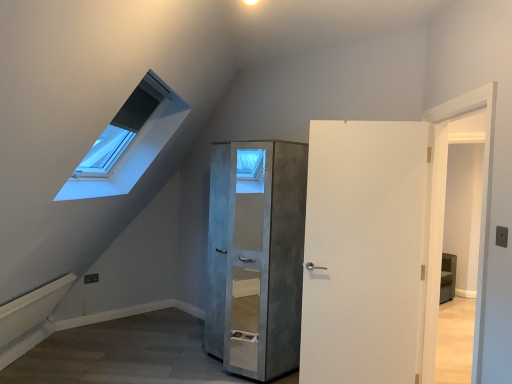
Where is `concrete textured cabinet at center`? This screenshot has width=512, height=384. concrete textured cabinet at center is located at coordinates click(256, 256).

What is the approximate width of concrete textured cabinet at center?

25.72 inches.

Describe the element at coordinates (256, 256) in the screenshot. Image resolution: width=512 pixels, height=384 pixels. I see `concrete textured cabinet at center` at that location.

I want to click on white matte door at center, so click(x=366, y=251).

In order to face white matte door at center, should I rotate leftwards or rightwards?

A 14.179 degree turn to the right will do.

Describe the element at coordinates (366, 251) in the screenshot. I see `white matte door at center` at that location.

Where is `concrete textured cabinet at center`? Image resolution: width=512 pixels, height=384 pixels. concrete textured cabinet at center is located at coordinates (256, 256).

Which is more to the right, concrete textured cabinet at center or white matte door at center?

Positioned to the right is white matte door at center.

Is concrete textured cabinet at center further to the viewer compared to white matte door at center?

Yes.

Does point (296, 180) appear closer or farther from the camera than point (413, 197)?

Clearly, point (296, 180) is more distant from the camera than point (413, 197).

From the image's perspective, is concrete textured cabinet at center located above white matte door at center?

No, from the image's perspective, concrete textured cabinet at center is not over white matte door at center.

From a real-world perspective, is concrete textured cabinet at center positioned above or below white matte door at center?

Clearly, from a real-world perspective, concrete textured cabinet at center is below white matte door at center.

Considering the sizes of objects concrete textured cabinet at center and white matte door at center in the image provided, who is wider, concrete textured cabinet at center or white matte door at center?

Wider between the two is concrete textured cabinet at center.

In terms of height, does concrete textured cabinet at center look taller or shorter compared to white matte door at center?

Considering their sizes, concrete textured cabinet at center has more height than white matte door at center.

Considering the relative sizes of concrete textured cabinet at center and white matte door at center in the image provided, is concrete textured cabinet at center smaller than white matte door at center?

No.

Is white matte door at center completely or partially inside concrete textured cabinet at center?

No, white matte door at center is not inside concrete textured cabinet at center.

Is concrete textured cabinet at center with white matte door at center?

No, concrete textured cabinet at center is not making contact with white matte door at center.

Is concrete textured cabinet at center facing towards white matte door at center?

No, concrete textured cabinet at center does not turn towards white matte door at center.

Where is `cupboard below the white matte door at center (from the image's perspective)`? The height and width of the screenshot is (384, 512). cupboard below the white matte door at center (from the image's perspective) is located at coordinates (256, 256).

Which object is positioned more to the left, white matte door at center or concrete textured cabinet at center?

concrete textured cabinet at center.

Based on the photo, considering their positions, is white matte door at center located in front of or behind concrete textured cabinet at center?

white matte door at center is positioned closer to the viewer than concrete textured cabinet at center.

Considering the points (327, 231) and (277, 228), which point is behind, point (327, 231) or point (277, 228)?

The point (277, 228) is more distant.

From the image's perspective, is white matte door at center positioned above or below concrete textured cabinet at center?

Based on their image positions, white matte door at center is located above concrete textured cabinet at center.

From a real-world perspective, which is physically below, white matte door at center or concrete textured cabinet at center?

concrete textured cabinet at center.

Which of these two, white matte door at center or concrete textured cabinet at center, is wider?

concrete textured cabinet at center.

Considering the relative sizes of white matte door at center and concrete textured cabinet at center in the image provided, is white matte door at center shorter than concrete textured cabinet at center?

Correct, white matte door at center is not as tall as concrete textured cabinet at center.

Is white matte door at center bigger than concrete textured cabinet at center?

Incorrect, white matte door at center is not larger than concrete textured cabinet at center.

Can concrete textured cabinet at center be found inside white matte door at center?

No, concrete textured cabinet at center is not inside white matte door at center.

Are white matte door at center and concrete textured cabinet at center located far from each other?

No, white matte door at center is not far away from concrete textured cabinet at center.

Is white matte door at center facing away from concrete textured cabinet at center?

No, white matte door at center is not facing the opposite direction of concrete textured cabinet at center.

How much distance is there between white matte door at center and concrete textured cabinet at center?

They are 27.16 inches apart.

Identify the location of door on the right of concrete textured cabinet at center. (366, 251).

You are a GUI agent. You are given a task and a screenshot of the screen. Output one action in this format:
    pyautogui.click(x=<x>, y=<y>)
    Task: Click on the door that appears above the concrete textured cabinet at center (from the image's perspective)
    The height and width of the screenshot is (384, 512).
    Given the screenshot: What is the action you would take?
    pyautogui.click(x=366, y=251)

This screenshot has height=384, width=512. Find the location of `cupboard below the white matte door at center (from a real-world perspective)`. cupboard below the white matte door at center (from a real-world perspective) is located at coordinates (256, 256).